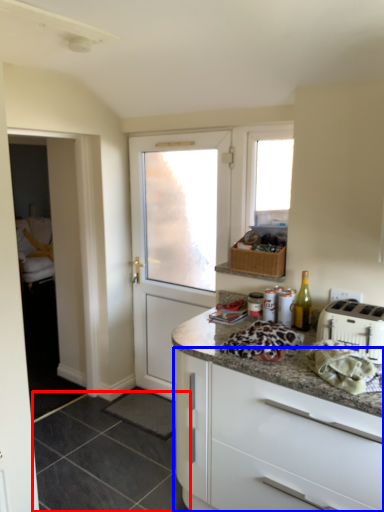
Question: Which of the following is the closest to the observer, tile (highlighted by a red box) or cabinetry (highlighted by a blue box)?

Choices:
 (A) tile
 (B) cabinetry

Answer: (B)